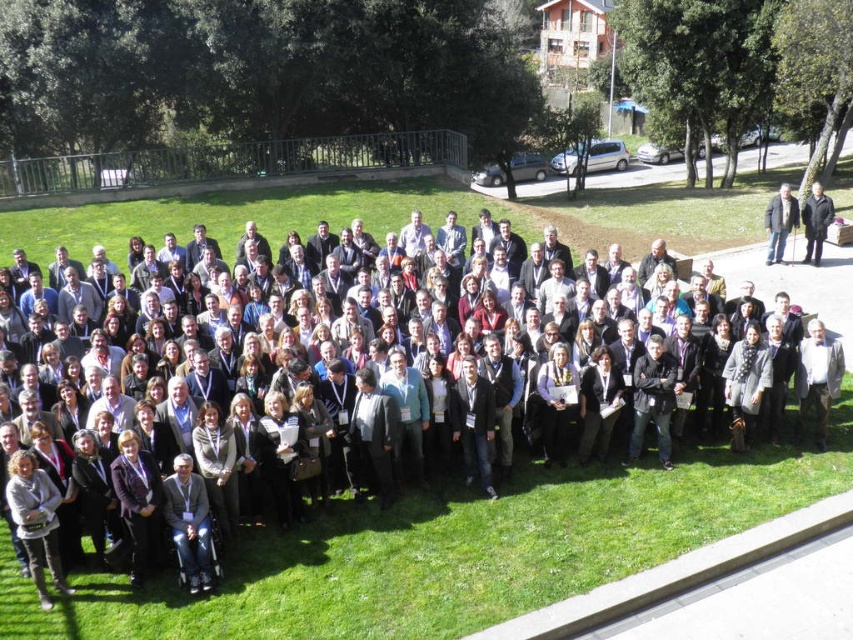
Is dark gray suit at center wider than black wool coat at right?

Indeed, dark gray suit at center has a greater width compared to black wool coat at right.

The height and width of the screenshot is (640, 853). What do you see at coordinates (509, 536) in the screenshot? I see `dark gray suit at center` at bounding box center [509, 536].

Find the location of `dark gray suit at center`. dark gray suit at center is located at coordinates (509, 536).

Find the location of a particular element. The width and height of the screenshot is (853, 640). light brown wool sweater at lower left is located at coordinates (36, 522).

Can you confirm if light brown wool sweater at lower left is smaller than black wool coat at right?

Indeed, light brown wool sweater at lower left has a smaller size compared to black wool coat at right.

Measure the distance between point (9, 464) and camera.

Point (9, 464) is 35.88 feet from camera.

Find the location of a particular element. Image resolution: width=853 pixels, height=640 pixels. light brown wool sweater at lower left is located at coordinates (36, 522).

Locate an element on the screen. The height and width of the screenshot is (640, 853). dark gray suit at center is located at coordinates click(509, 536).

Measure the distance between point (699, 508) and camera.

12.62 meters

This screenshot has width=853, height=640. Find the location of `dark gray suit at center`. dark gray suit at center is located at coordinates (509, 536).